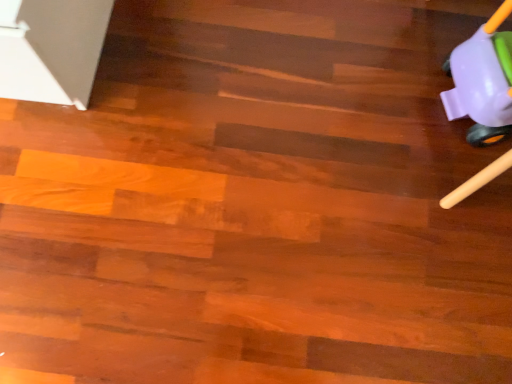
The width and height of the screenshot is (512, 384). I want to click on vacant space behind purple plastic toy at upper right, so click(434, 28).